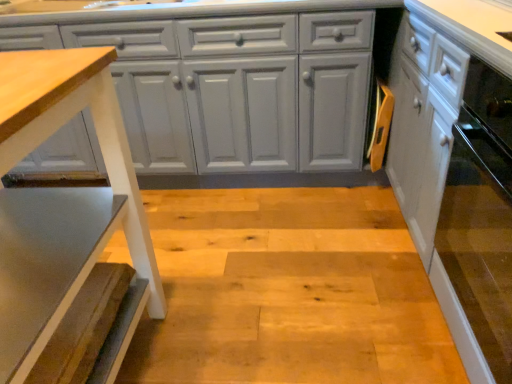
Question: Does wooden textured step stool at left have a smaller size compared to white glossy cabinet at right, the first cabinetry viewed from the right?

Choices:
 (A) no
 (B) yes

Answer: (B)

Question: Can you confirm if wooden textured step stool at left is wider than white glossy cabinet at right, the first cabinetry viewed from the right?

Choices:
 (A) no
 (B) yes

Answer: (B)

Question: Does wooden textured step stool at left have a greater height compared to white glossy cabinet at right, placed as the 2th cabinetry when sorted from left to right?

Choices:
 (A) no
 (B) yes

Answer: (A)

Question: Is wooden textured step stool at left positioned far away from white glossy cabinet at right, placed as the 2th cabinetry when sorted from left to right?

Choices:
 (A) no
 (B) yes

Answer: (A)

Question: Is wooden textured step stool at left to the right of white glossy cabinet at right, the first cabinetry viewed from the right, from the viewer's perspective?

Choices:
 (A) yes
 (B) no

Answer: (B)

Question: Looking at the image, does wooden textured step stool at left seem bigger or smaller compared to white glossy cabinet at right, placed as the 2th cabinetry when sorted from left to right?

Choices:
 (A) small
 (B) big

Answer: (A)

Question: From the image's perspective, is wooden textured step stool at left located above or below white glossy cabinet at right, placed as the 2th cabinetry when sorted from left to right?

Choices:
 (A) above
 (B) below

Answer: (B)

Question: Considering the positions of wooden textured step stool at left and white glossy cabinet at right, the first cabinetry viewed from the right, in the image, is wooden textured step stool at left wider or thinner than white glossy cabinet at right, the first cabinetry viewed from the right,?

Choices:
 (A) wide
 (B) thin

Answer: (A)

Question: From their relative heights in the image, would you say wooden textured step stool at left is taller or shorter than white glossy cabinet at right, placed as the 2th cabinetry when sorted from left to right?

Choices:
 (A) short
 (B) tall

Answer: (A)

Question: Is white glossy cabinet at right, the first cabinetry viewed from the right, in front of or behind matte gray cabinet at center, which appears as the 1th cabinetry when viewed from the left, in the image?

Choices:
 (A) front
 (B) behind

Answer: (A)

Question: Based on their sizes in the image, would you say white glossy cabinet at right, placed as the 2th cabinetry when sorted from left to right, is bigger or smaller than matte gray cabinet at center, which ranks as the 2th cabinetry in right-to-left order?

Choices:
 (A) small
 (B) big

Answer: (A)

Question: Considering the positions of point (443, 38) and point (64, 130), is point (443, 38) closer or farther from the camera than point (64, 130)?

Choices:
 (A) closer
 (B) farther

Answer: (A)

Question: Considering the positions of white glossy cabinet at right, placed as the 2th cabinetry when sorted from left to right, and matte gray cabinet at center, which ranks as the 2th cabinetry in right-to-left order, in the image, is white glossy cabinet at right, placed as the 2th cabinetry when sorted from left to right, taller or shorter than matte gray cabinet at center, which ranks as the 2th cabinetry in right-to-left order,?

Choices:
 (A) tall
 (B) short

Answer: (A)

Question: From the image's perspective, is wooden textured step stool at left positioned above or below matte gray cabinet at center, which ranks as the 2th cabinetry in right-to-left order?

Choices:
 (A) below
 (B) above

Answer: (A)

Question: From a real-world perspective, is wooden textured step stool at left physically located above or below matte gray cabinet at center, which ranks as the 2th cabinetry in right-to-left order?

Choices:
 (A) below
 (B) above

Answer: (B)